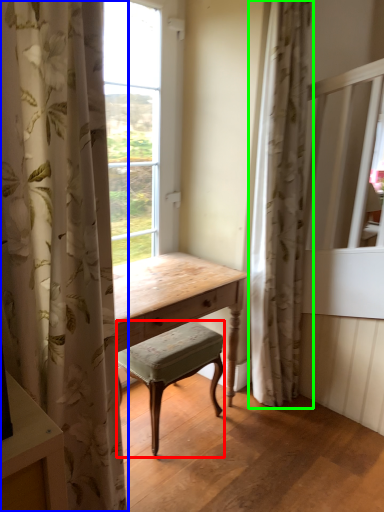
Question: Which object is positioned closest to stool (highlighted by a red box)? Select from curtain (highlighted by a blue box) and curtain (highlighted by a green box).

Choices:
 (A) curtain
 (B) curtain

Answer: (B)